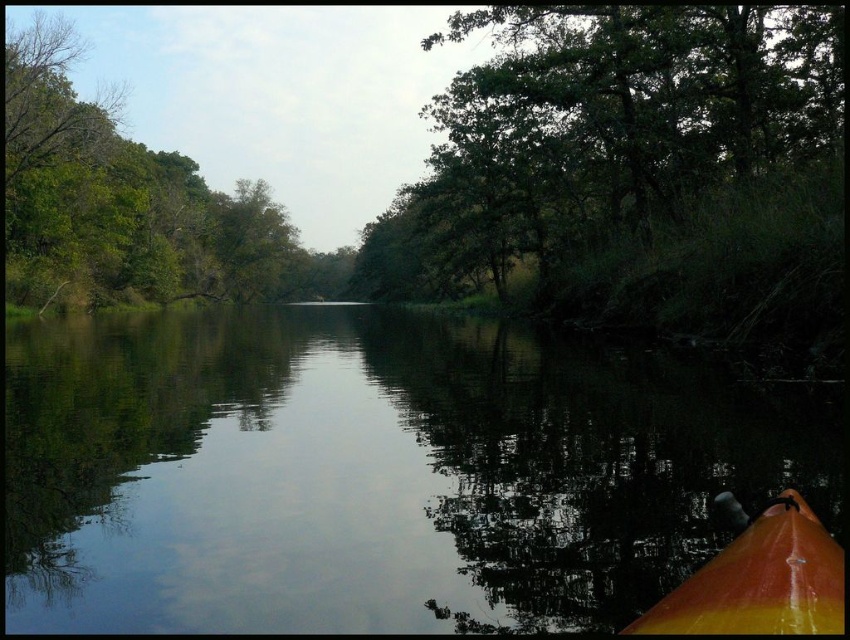
You are planning to paddle the orange glossy canoe at lower right across the smooth water at center. Considering the size of the water and the canoe, will there be enough space for the canoe to move freely?

The smooth water at center is larger in size than the orange glossy canoe at lower right, so there should be enough space for the canoe to move freely.

You are standing at the edge of the river and want to cross it using a small boat. The boat can only be placed on the smooth water at center. Where should you place the boat to ensure it floats smoothly?

You should place the boat at the smooth water at center located at point (363, 474) to ensure it floats smoothly.